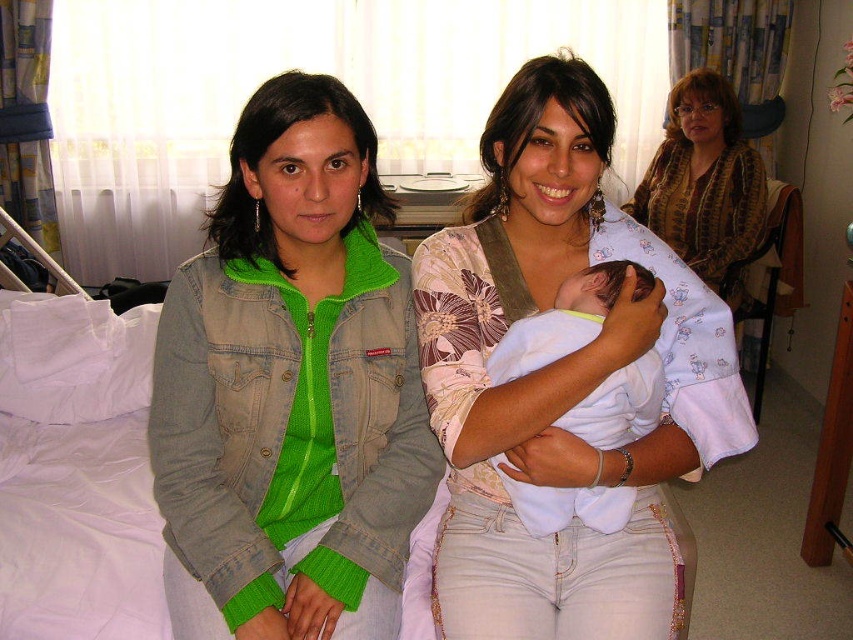
Can you confirm if green denim jacket at left is smaller than white soft cloth at center?

Incorrect, green denim jacket at left is not smaller in size than white soft cloth at center.

Is green denim jacket at left positioned at the back of white soft cloth at center?

No, it is not.

This screenshot has width=853, height=640. What do you see at coordinates (289, 387) in the screenshot? I see `green denim jacket at left` at bounding box center [289, 387].

The image size is (853, 640). Identify the location of green denim jacket at left. (289, 387).

Between white soft cloth at center and patterned fabric baby at upper right, which one is positioned higher?

patterned fabric baby at upper right

Find the location of a particular element. white soft cloth at center is located at coordinates (564, 321).

I want to click on white soft cloth at center, so click(564, 321).

Can you confirm if green denim jacket at left is smaller than white cotton baby at center?

Yes, green denim jacket at left is smaller than white cotton baby at center.

Does green denim jacket at left appear on the right side of white cotton baby at center?

In fact, green denim jacket at left is to the left of white cotton baby at center.

Identify the location of green denim jacket at left. This screenshot has width=853, height=640. (289, 387).